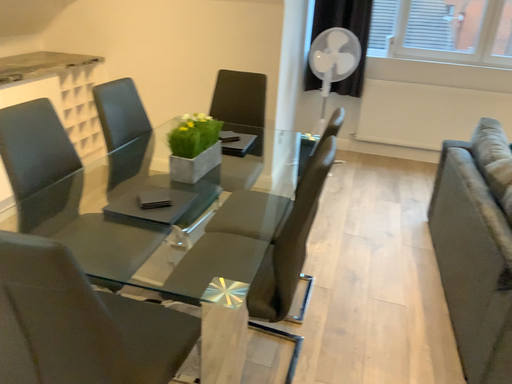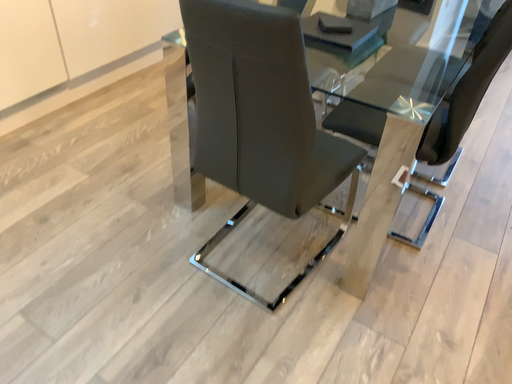
Question: Which way did the camera rotate in the video?

Choices:
 (A) rotated left
 (B) rotated right

Answer: (A)